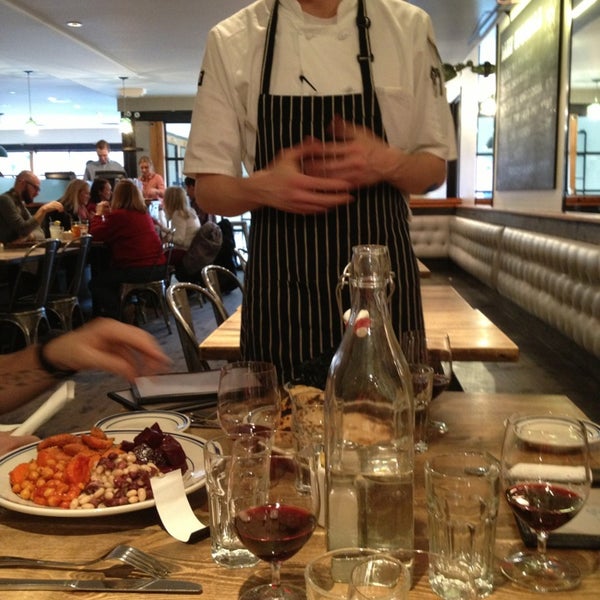
Where is `white ceiling`? Image resolution: width=600 pixels, height=600 pixels. white ceiling is located at coordinates (134, 29).